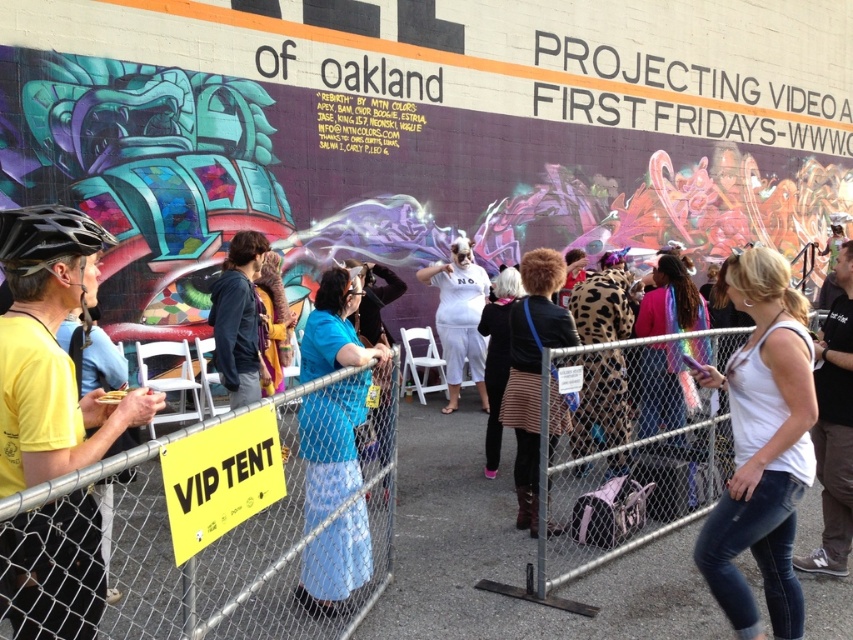
You are a photographer positioned at the front of the crowd. You want to take a photo of both the leather jacket at center and the white plush costume at center. Which object should you focus on first to ensure both are in sharp focus?

You should focus on the leather jacket at center first since it is closer to the viewer than the white plush costume at center. By focusing on the closer object, the farther one may still be in acceptable focus depending on the depth of field.